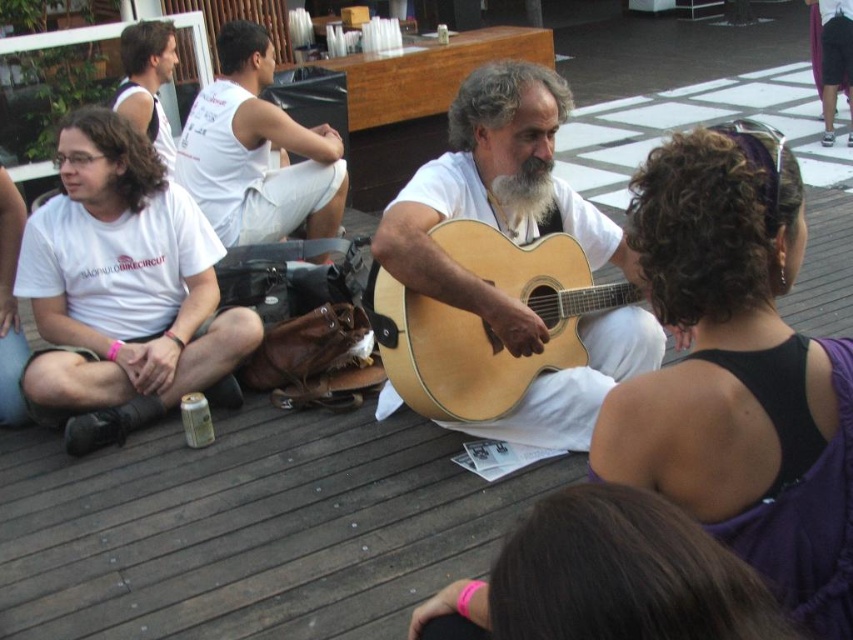
Can you confirm if white cotton shirt at upper left is positioned to the right of white cotton tank top at upper left?

Indeed, white cotton shirt at upper left is positioned on the right side of white cotton tank top at upper left.

Is white cotton shirt at upper left closer to camera compared to white cotton tank top at upper left?

Yes, white cotton shirt at upper left is closer to the viewer.

Which is behind, point (236, 209) or point (136, 125)?

The point (236, 209) is behind.

Find the location of a particular element. The image size is (853, 640). white cotton shirt at upper left is located at coordinates (257, 150).

Does white cotton shirt at upper left appear on the left side of white matte beard at center?

Indeed, white cotton shirt at upper left is positioned on the left side of white matte beard at center.

Can you confirm if white cotton shirt at upper left is taller than white matte beard at center?

Indeed, white cotton shirt at upper left has a greater height compared to white matte beard at center.

Where is `white cotton shirt at upper left`? This screenshot has height=640, width=853. white cotton shirt at upper left is located at coordinates (257, 150).

Can you confirm if white cotton t-shirt at left is shorter than white cotton shirt at upper left?

Incorrect, white cotton t-shirt at left's height does not fall short of white cotton shirt at upper left's.

The image size is (853, 640). Describe the element at coordinates (120, 289) in the screenshot. I see `white cotton t-shirt at left` at that location.

Where is `white cotton t-shirt at left`? This screenshot has width=853, height=640. white cotton t-shirt at left is located at coordinates (120, 289).